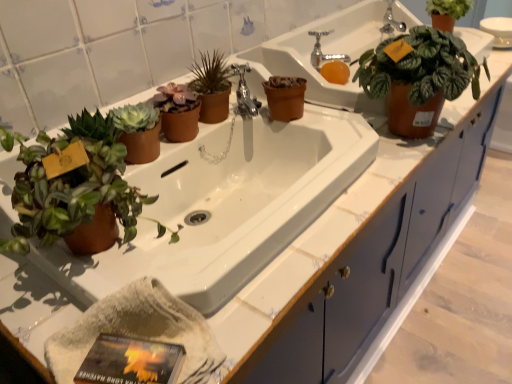
Where is `free point to the right of hardcover book at lower left`? The width and height of the screenshot is (512, 384). free point to the right of hardcover book at lower left is located at coordinates (248, 319).